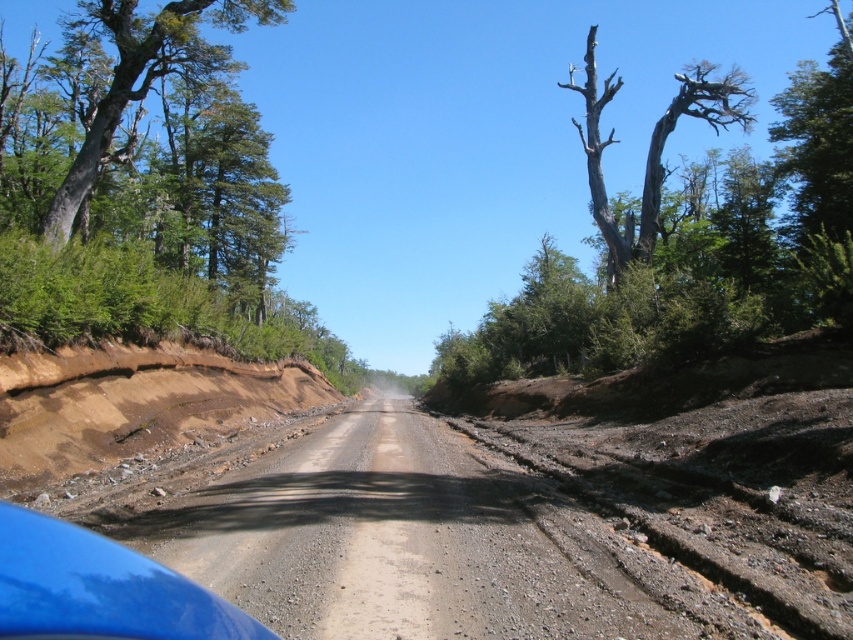
Question: Can you confirm if green leafy tree at left is positioned above blue glossy car at lower left?

Choices:
 (A) no
 (B) yes

Answer: (B)

Question: Which object appears closest to the camera in this image?

Choices:
 (A) green leafy tree at left
 (B) bare wood tree at upper right

Answer: (A)

Question: Which object appears farthest from the camera in this image?

Choices:
 (A) green leafy tree at left
 (B) blue glossy car at lower left

Answer: (A)

Question: Does green leafy tree at left lie in front of bare wood tree at upper right?

Choices:
 (A) yes
 (B) no

Answer: (A)

Question: Which point is farther to the camera?

Choices:
 (A) green leafy tree at left
 (B) bare wood tree at upper right

Answer: (B)

Question: Does green leafy tree at left appear on the right side of bare wood tree at upper right?

Choices:
 (A) yes
 (B) no

Answer: (B)